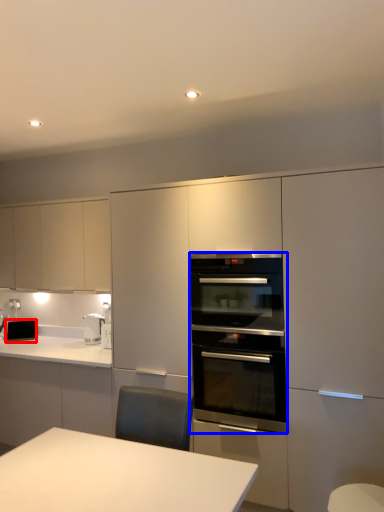
Question: Which of the following is the closest to the observer, appliance (highlighted by a red box) or kitchen appliance (highlighted by a blue box)?

Choices:
 (A) appliance
 (B) kitchen appliance

Answer: (B)